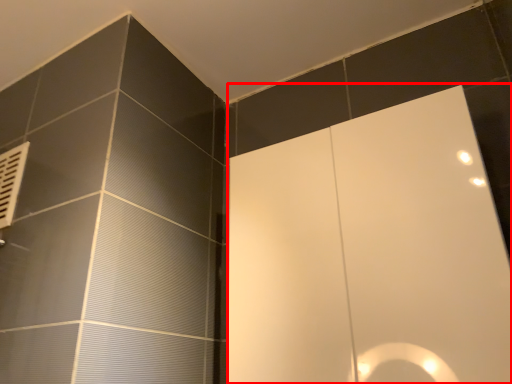
Question: From the image's perspective, where is screen door (annotated by the red box) located in relation to air conditioner in the image?

Choices:
 (A) above
 (B) below

Answer: (B)